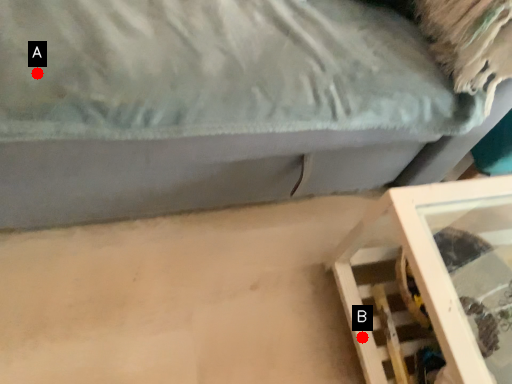
Question: Two points are circled on the image, labeled by A and B beside each circle. Which point appears closest to the camera in this image?

Choices:
 (A) A is closer
 (B) B is closer

Answer: (A)